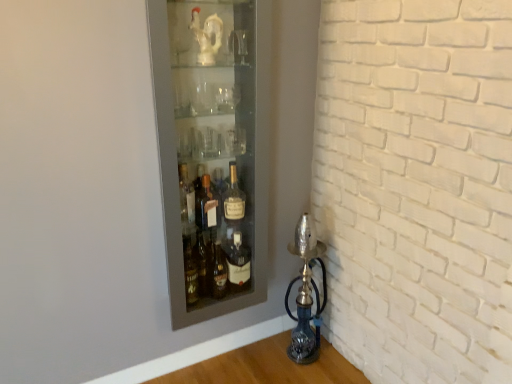
The image size is (512, 384). What do you see at coordinates (208, 147) in the screenshot?
I see `matte glass cabinet at upper left` at bounding box center [208, 147].

Describe the element at coordinates (306, 293) in the screenshot. I see `blue glass oil lamp at lower right` at that location.

Measure the distance between point (228, 218) and camera.

They are 5.47 feet apart.

Locate an element on the screen. This screenshot has height=384, width=512. matte glass cabinet at upper left is located at coordinates (208, 147).

Considering the sizes of objects matte glass bottle at center and matte glass cabinet at upper left in the image provided, who is smaller, matte glass bottle at center or matte glass cabinet at upper left?

matte glass bottle at center.

Between matte glass bottle at center and matte glass cabinet at upper left, which one has more height?

With more height is matte glass cabinet at upper left.

Which object is more forward, matte glass bottle at center or matte glass cabinet at upper left?

Positioned in front is matte glass cabinet at upper left.

Does point (234, 209) appear closer or farther from the camera than point (241, 182)?

Clearly, point (234, 209) is closer to the camera than point (241, 182).

This screenshot has height=384, width=512. I want to click on shelf lying on the left of blue glass oil lamp at lower right, so click(x=208, y=147).

Which is in front, point (168, 157) or point (300, 230)?

Point (168, 157)

Is matte glass cabinet at upper left oriented away from blue glass oil lamp at lower right?

matte glass cabinet at upper left does not have its back to blue glass oil lamp at lower right.

From the image's perspective, which one is positioned lower, matte glass cabinet at upper left or matte glass bottle at center?

matte glass bottle at center, from the image's perspective.

Between point (254, 126) and point (228, 197), which one is positioned behind?

The point (228, 197) is more distant.

Is matte glass cabinet at upper left turned away from matte glass bottle at center?

Correct, matte glass cabinet at upper left is looking away from matte glass bottle at center.

Considering the sizes of matte glass cabinet at upper left and matte glass bottle at center in the image, is matte glass cabinet at upper left bigger or smaller than matte glass bottle at center?

matte glass cabinet at upper left is bigger than matte glass bottle at center.

From the image's perspective, is blue glass oil lamp at lower right over matte glass bottle at center?

No, from the image's perspective, blue glass oil lamp at lower right is not over matte glass bottle at center.

The image size is (512, 384). Find the location of `oil lamp on the right side of matte glass bottle at center`. oil lamp on the right side of matte glass bottle at center is located at coordinates (306, 293).

Is blue glass oil lamp at lower right further to the viewer compared to matte glass bottle at center?

Yes.

Which is further, (314, 252) or (223, 27)?

The point (314, 252) is farther from the camera.

In the image, is blue glass oil lamp at lower right on the left side or the right side of matte glass cabinet at upper left?

blue glass oil lamp at lower right is positioned on matte glass cabinet at upper left's right side.

Is blue glass oil lamp at lower right positioned far away from matte glass cabinet at upper left?

They are positioned close to each other.

Which is in front, blue glass oil lamp at lower right or matte glass cabinet at upper left?

matte glass cabinet at upper left is closer to the camera.

Relative to blue glass oil lamp at lower right, is matte glass bottle at center in front or behind?

matte glass bottle at center is positioned closer to the viewer than blue glass oil lamp at lower right.

Consider the image. Is matte glass bottle at center outside of blue glass oil lamp at lower right?

Yes, matte glass bottle at center is not within blue glass oil lamp at lower right.

Measure the distance between matte glass bottle at center and blue glass oil lamp at lower right.

matte glass bottle at center is 48.99 centimeters from blue glass oil lamp at lower right.

Does matte glass bottle at center have a lesser width compared to blue glass oil lamp at lower right?

Correct, the width of matte glass bottle at center is less than that of blue glass oil lamp at lower right.

Find the location of a particular element. The image size is (512, 384). bottle that is below the matte glass cabinet at upper left (from the image's perspective) is located at coordinates (234, 197).

You are a GUI agent. You are given a task and a screenshot of the screen. Output one action in this format:
    pyautogui.click(x=<x>, y=<y>)
    Task: Click on the shelf in front of the blue glass oil lamp at lower right
    This screenshot has height=384, width=512.
    Given the screenshot: What is the action you would take?
    pyautogui.click(x=208, y=147)

Looking at the image, which one is located closer to blue glass oil lamp at lower right, matte glass bottle at center or matte glass cabinet at upper left?

matte glass cabinet at upper left is closer to blue glass oil lamp at lower right.

Which object lies further to the anchor point matte glass bottle at center, blue glass oil lamp at lower right or matte glass cabinet at upper left?

Among the two, blue glass oil lamp at lower right is located further to matte glass bottle at center.

When comparing their distances from matte glass bottle at center, does matte glass cabinet at upper left or blue glass oil lamp at lower right seem closer?

Based on the image, matte glass cabinet at upper left appears to be nearer to matte glass bottle at center.

Which object lies further to the anchor point blue glass oil lamp at lower right, matte glass cabinet at upper left or matte glass bottle at center?

matte glass bottle at center.

From the image, which object appears to be farther from matte glass cabinet at upper left, matte glass bottle at center or blue glass oil lamp at lower right?

The object further to matte glass cabinet at upper left is blue glass oil lamp at lower right.

Looking at the image, which one is located further to matte glass cabinet at upper left, blue glass oil lamp at lower right or matte glass bottle at center?

blue glass oil lamp at lower right lies further to matte glass cabinet at upper left than the other object.

Where is `bottle between matte glass cabinet at upper left and blue glass oil lamp at lower right vertically`? This screenshot has width=512, height=384. bottle between matte glass cabinet at upper left and blue glass oil lamp at lower right vertically is located at coordinates (234, 197).